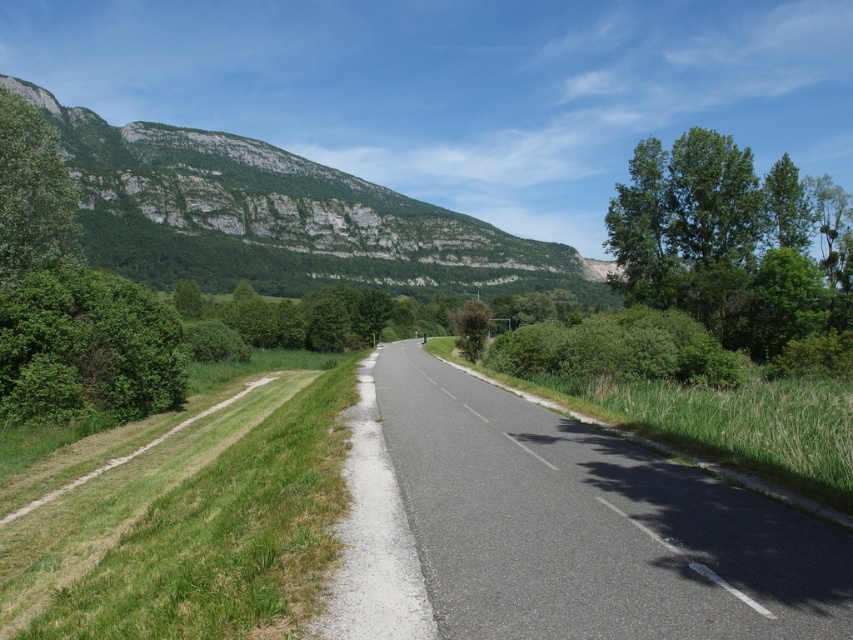
Looking at this image, does green leafy tree at upper right come in front of green leafy bush at left?

No, green leafy tree at upper right is further to the viewer.

Identify the location of green leafy tree at upper right. (730, 241).

Does point (496, 580) come in front of point (102, 410)?

Yes, it is.

Is point (375, 596) farther from camera compared to point (15, 387)?

No, it is not.

What do you see at coordinates (560, 528) in the screenshot? I see `asphalt road at center` at bounding box center [560, 528].

This screenshot has height=640, width=853. I want to click on asphalt road at center, so click(x=560, y=528).

Is green leafy bush at left above green leafy tree at upper left?

Actually, green leafy bush at left is below green leafy tree at upper left.

Does green leafy bush at left appear on the right side of green leafy tree at upper left?

Yes, green leafy bush at left is to the right of green leafy tree at upper left.

Is point (115, 285) less distant than point (9, 141)?

That is False.

The image size is (853, 640). What are the coordinates of `green leafy bush at left` in the screenshot? It's located at (86, 348).